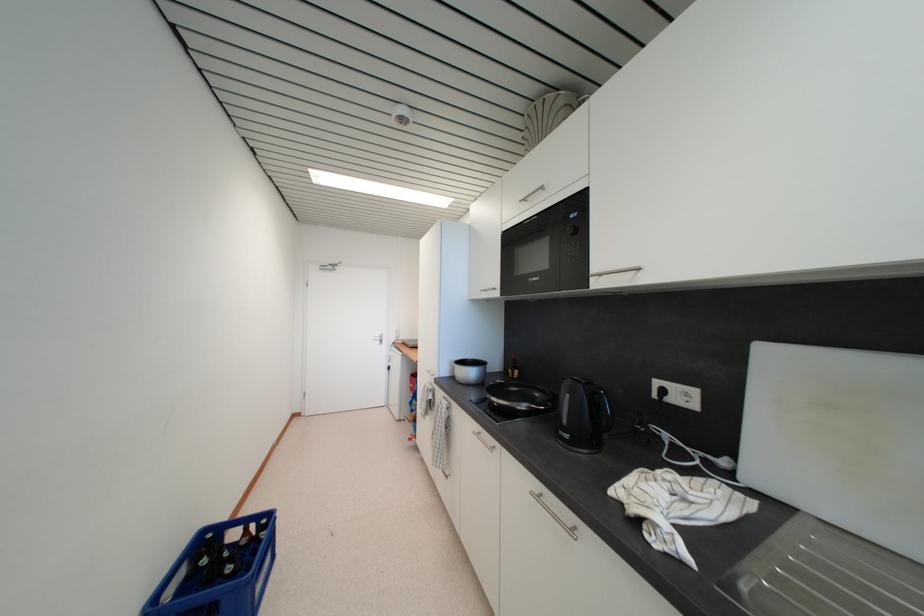
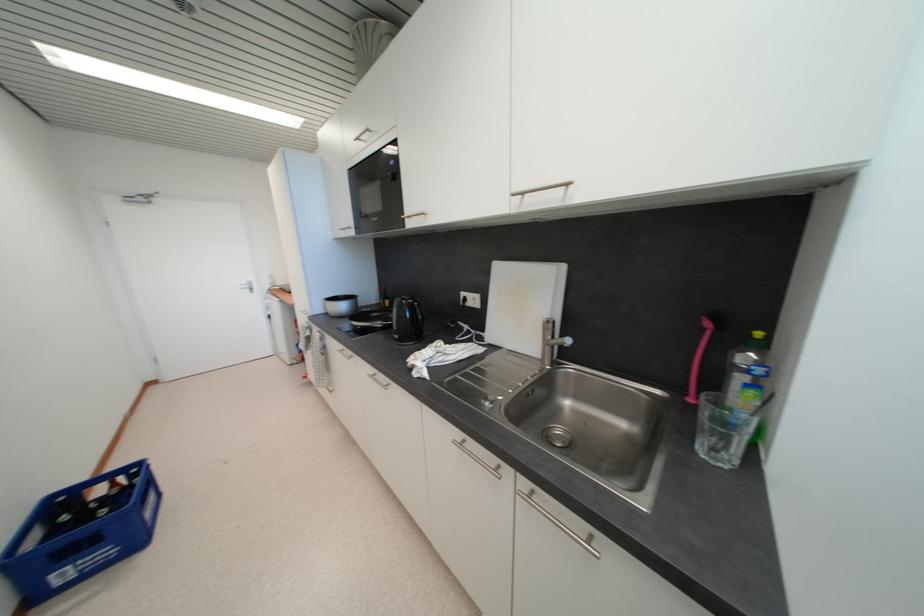
Find the pixel in the second image that matches point (572, 439) in the first image.

(402, 339)